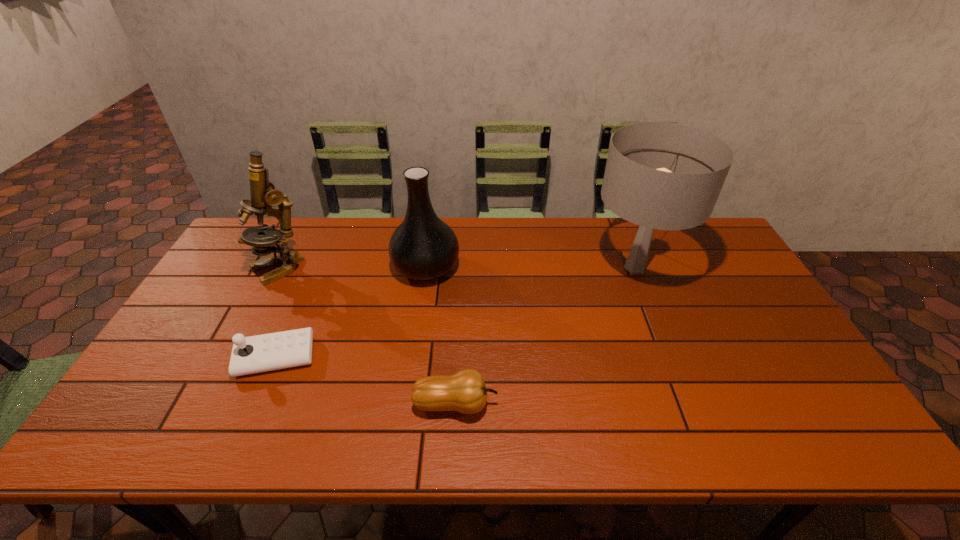
At what (x,y) coordinates should I click in order to perform the action: click on lampshade. Please return your answer as a coordinate pair (x, y). The image size is (960, 540). Looking at the image, I should click on 659,175.

At what (x,y) coordinates should I click in order to perform the action: click on microscope. Please return your answer as a coordinate pair (x, y). Looking at the image, I should click on tap(263, 194).

Locate an element on the screen. The image size is (960, 540). vase is located at coordinates (423, 247).

What are the coordinates of `joystick` in the screenshot? It's located at (254, 354).

Find the location of `the nearest object`. the nearest object is located at coordinates 465,391.

I want to click on blank space located on the front-facing side of the rightmost object, so click(x=550, y=267).

Identify the location of vacant space located 0.210m on the front-facing side of the rightmost object. The width and height of the screenshot is (960, 540). (522, 267).

Locate an element on the screen. This screenshot has width=960, height=540. vacant space located on the front-facing side of the rightmost object is located at coordinates (572, 267).

At what (x,y) coordinates should I click in order to perform the action: click on vacant space located on the front of the microscope. Please return your answer as a coordinate pair (x, y). This screenshot has width=960, height=540. Looking at the image, I should click on (262, 298).

The image size is (960, 540). I want to click on vacant region located 0.240m on the left of the vase, so click(x=318, y=267).